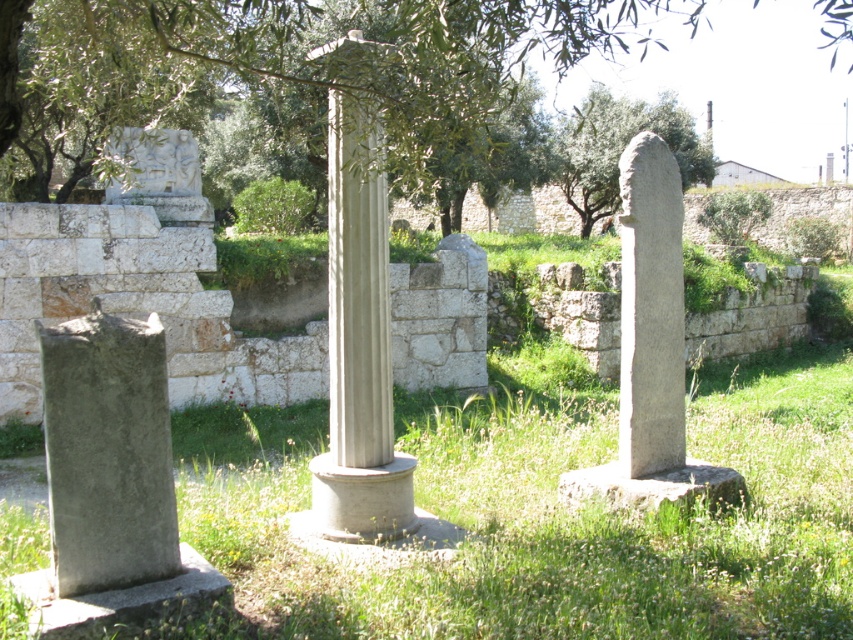
Question: Can you confirm if smooth stone column at center is bigger than gray stone pillar at right?

Choices:
 (A) yes
 (B) no

Answer: (A)

Question: Which object appears closest to the camera in this image?

Choices:
 (A) smooth stone column at center
 (B) gray stone pillar at right

Answer: (A)

Question: Which is farther from the gray stone pillar at right?

Choices:
 (A) smooth stone column at center
 (B) green leafy tree at upper center

Answer: (B)

Question: Is green leafy tree at upper center positioned behind gray stone pillar at right?

Choices:
 (A) no
 (B) yes

Answer: (A)

Question: Is green leafy tree at upper center above smooth stone column at center?

Choices:
 (A) yes
 (B) no

Answer: (A)

Question: Which of these objects is positioned closest to the smooth stone column at center?

Choices:
 (A) green leafy tree at upper center
 (B) gray stone pillar at right

Answer: (B)